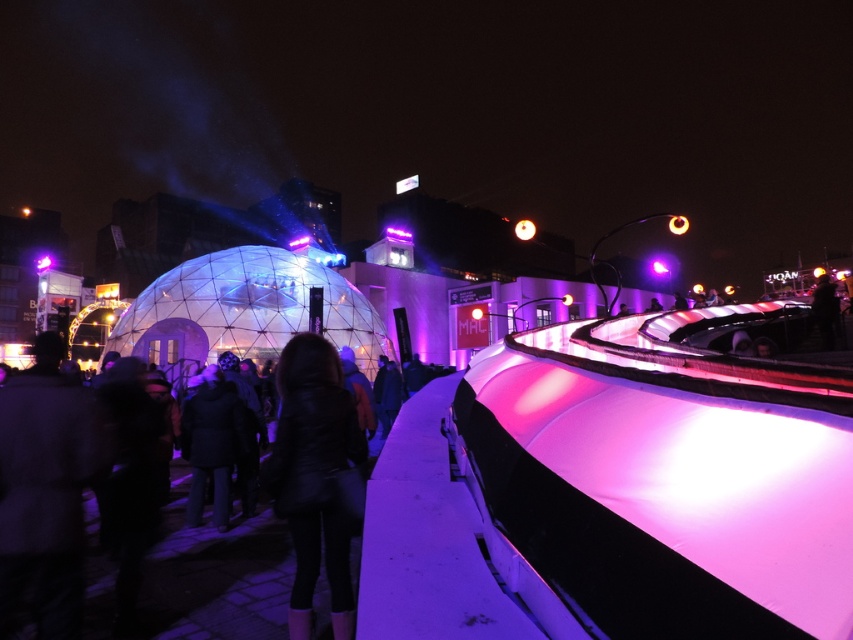
You are navigating through the event and want to move from the point at coordinates point (239,593) to the point at coordinates point (514,228). Considering the spatial arrangement, which direction should you move relative to the other point?

Point (239,593) is in front of point (514,228), so to move from point (239,593) to point (514,228), you should move backward relative to point (514,228).